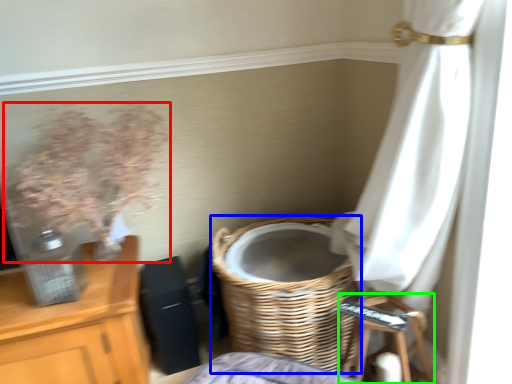
Question: Considering the real-world distances, which object is closest to floral arrangement (highlighted by a red box)? basket (highlighted by a blue box) or step stool (highlighted by a green box).

Choices:
 (A) basket
 (B) step stool

Answer: (A)